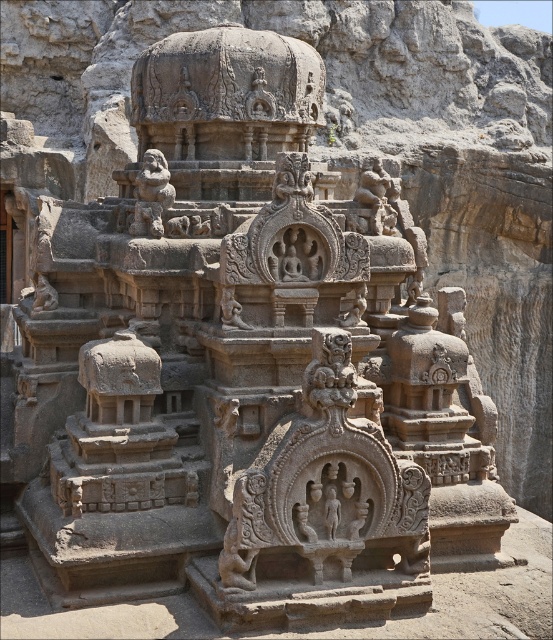
Based on the scene description, where is the dark gray stone statue at center located in terms of its 2D coordinates?

The dark gray stone statue at center is located at the 2D coordinates of point (232, 310).

You are an archaeologist examining the central area of the stone structure. You see the dark gray stone statue at center and the rustic stone lion at center. Which one is positioned to the right side?

The dark gray stone statue at center is positioned to the right of the rustic stone lion at center.